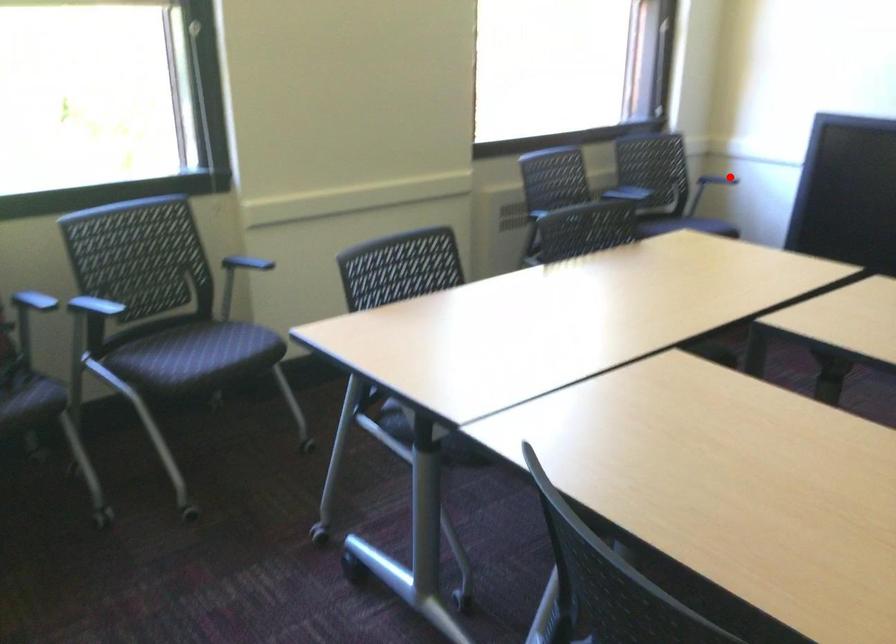
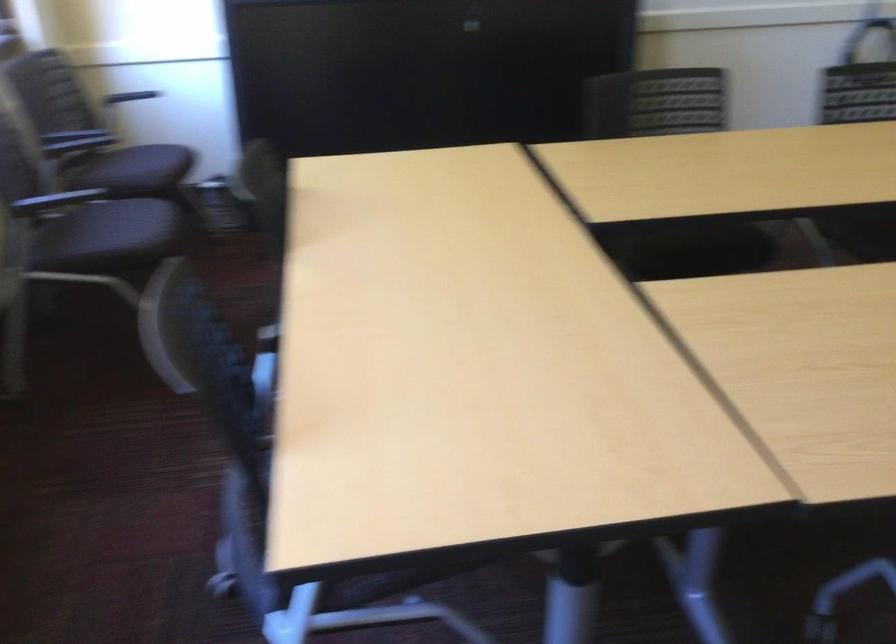
Question: I am providing you with two images of the same scene from different viewpoints. A red point is marked on the first image. Can you still see the location of the red point in image 2?

Choices:
 (A) Yes
 (B) No

Answer: (A)